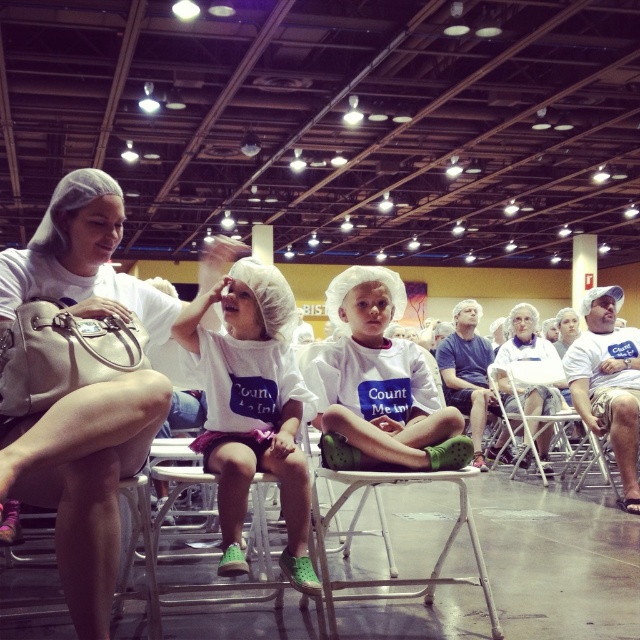
Question: Is matte white hairnet at upper left thinner than metallic silver folding chair at center?

Choices:
 (A) yes
 (B) no

Answer: (A)

Question: Among these objects, which one is nearest to the camera?

Choices:
 (A) metallic silver folding chair at center
 (B) matte white hairnet at upper left

Answer: (B)

Question: Is matte white hairnet at upper left to the right of metallic silver folding chair at center from the viewer's perspective?

Choices:
 (A) yes
 (B) no

Answer: (B)

Question: Which point is farther to the camera?

Choices:
 (A) (x=566, y=416)
 (B) (x=90, y=529)

Answer: (A)

Question: Does matte white hairnet at upper left have a greater width compared to metallic silver folding chair at center?

Choices:
 (A) no
 (B) yes

Answer: (A)